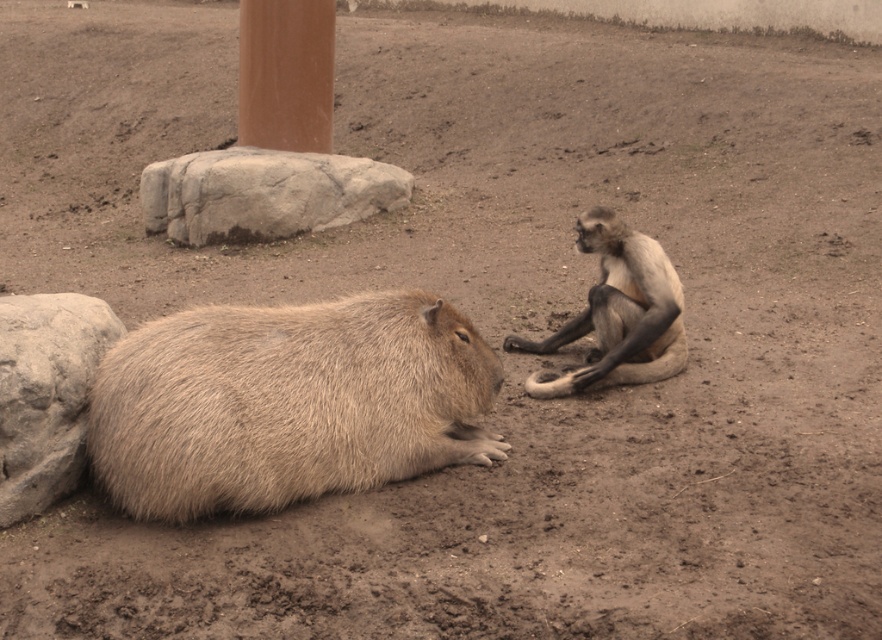
Is gray furry monkey at right closer to the viewer compared to brown polished stone pillar at upper center?

Yes, gray furry monkey at right is in front of brown polished stone pillar at upper center.

Consider the image. Which is below, gray furry monkey at right or brown polished stone pillar at upper center?

gray furry monkey at right is lower down.

Identify the location of gray furry monkey at right. (617, 314).

Does gray rough rock at center appear on the left side of brown polished stone pillar at upper center?

No, gray rough rock at center is not to the left of brown polished stone pillar at upper center.

Between gray rough rock at center and brown polished stone pillar at upper center, which one appears on the right side from the viewer's perspective?

gray rough rock at center is more to the right.

The height and width of the screenshot is (640, 882). Identify the location of gray rough rock at center. (264, 193).

I want to click on gray rough rock at center, so click(x=264, y=193).

Identify the location of fuzzy brown capybara at lower left. Image resolution: width=882 pixels, height=640 pixels. (288, 403).